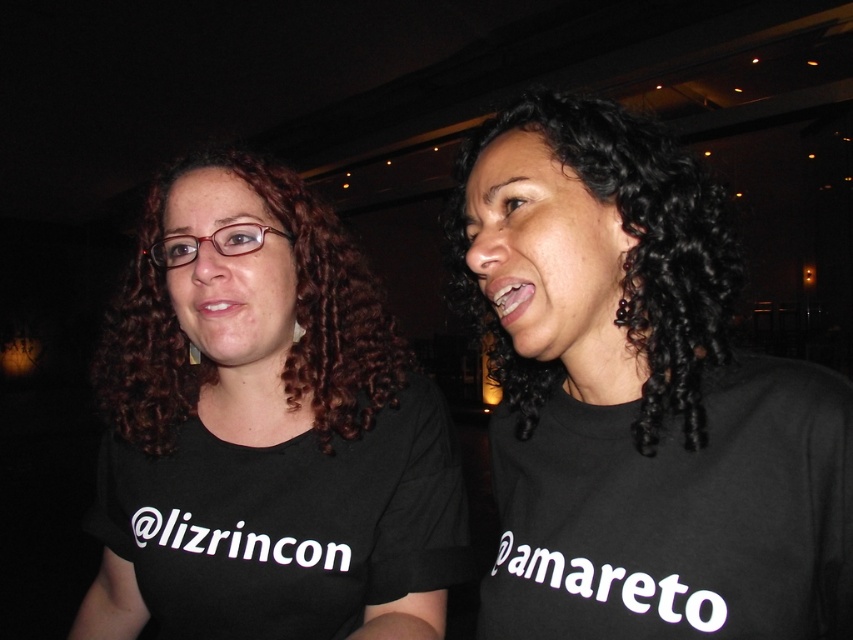
Question: Does black matte shirt at center lie in front of black cotton t-shirt at upper right?

Choices:
 (A) yes
 (B) no

Answer: (B)

Question: In this image, where is black matte t-shirt at left located relative to black cotton t-shirt at upper right?

Choices:
 (A) left
 (B) right

Answer: (A)

Question: Based on their relative distances, which object is farther from the black matte shirt at center?

Choices:
 (A) black curly hair at center
 (B) black matte t-shirt at left
 (C) black cotton t-shirt at upper right

Answer: (B)

Question: Estimate the real-world distances between objects in this image. Which object is farther from the black matte shirt at center?

Choices:
 (A) black matte t-shirt at left
 (B) black cotton t-shirt at upper right
 (C) black curly hair at center

Answer: (A)

Question: Based on their relative distances, which object is nearer to the black matte t-shirt at left?

Choices:
 (A) black curly hair at center
 (B) black cotton t-shirt at upper right

Answer: (A)

Question: Is black matte shirt at center thinner than black cotton t-shirt at upper right?

Choices:
 (A) no
 (B) yes

Answer: (A)